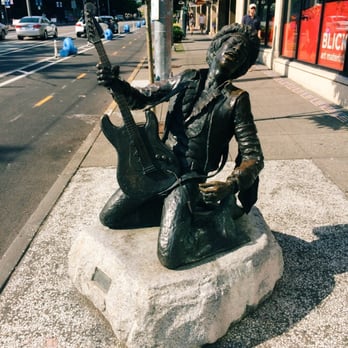
Find the location of a particular element. This screenshot has width=348, height=348. window is located at coordinates (308, 24), (337, 15), (288, 34), (269, 35), (263, 27), (32, 17), (42, 20), (46, 20), (107, 18), (80, 20).